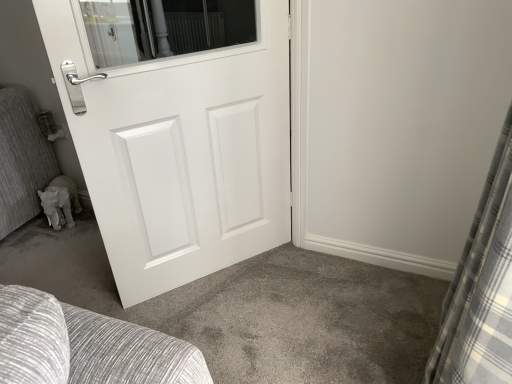
Question: Is point (454, 372) closer or farther from the camera than point (109, 221)?

Choices:
 (A) farther
 (B) closer

Answer: (B)

Question: Is gray plaid curtain at right inside or outside of white matte door at center?

Choices:
 (A) inside
 (B) outside

Answer: (B)

Question: From the image's perspective, relative to white matte door at center, is gray plaid curtain at right above or below?

Choices:
 (A) below
 (B) above

Answer: (A)

Question: From the image's perspective, is white matte door at center located above or below gray plaid curtain at right?

Choices:
 (A) below
 (B) above

Answer: (B)

Question: Considering the positions of point (88, 137) and point (482, 296), is point (88, 137) closer or farther from the camera than point (482, 296)?

Choices:
 (A) farther
 (B) closer

Answer: (A)

Question: Is white matte door at center wider or thinner than gray plaid curtain at right?

Choices:
 (A) wide
 (B) thin

Answer: (B)

Question: Looking at the image, does white matte door at center seem bigger or smaller compared to gray plaid curtain at right?

Choices:
 (A) small
 (B) big

Answer: (A)